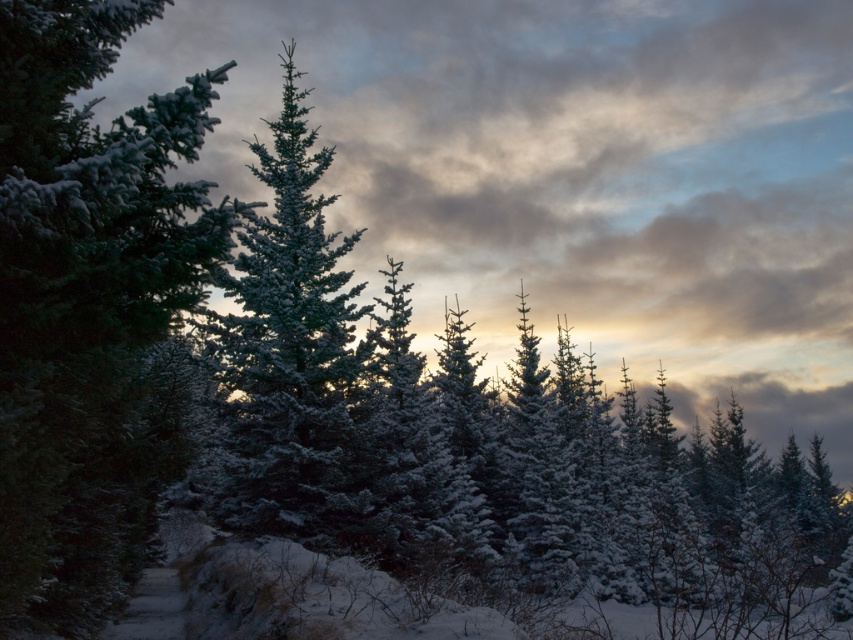
Question: Does snow-covered evergreen at left have a greater width compared to snow-covered evergreen at center?

Choices:
 (A) no
 (B) yes

Answer: (A)

Question: Which point is closer to the camera?

Choices:
 (A) (283, 401)
 (B) (119, 464)

Answer: (B)

Question: Can you confirm if snow-covered evergreen at left is bigger than snow-covered evergreen at center?

Choices:
 (A) yes
 (B) no

Answer: (B)

Question: Is snow-covered evergreen at left positioned at the back of snow-covered evergreen at center?

Choices:
 (A) no
 (B) yes

Answer: (A)

Question: Which object appears farthest from the camera in this image?

Choices:
 (A) snow-covered evergreen at center
 (B) snow-covered evergreen at left

Answer: (A)